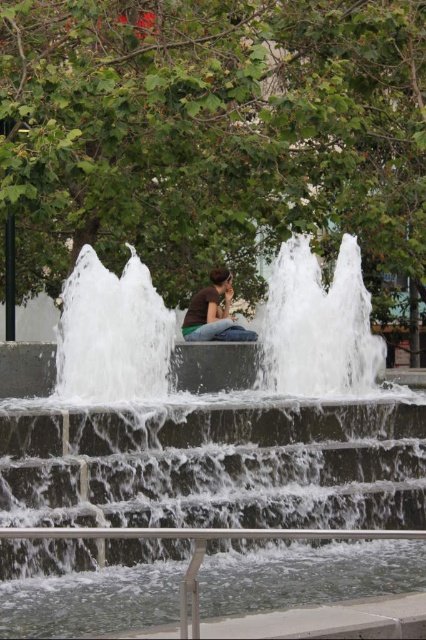
Question: Which object appears farthest from the camera in this image?

Choices:
 (A) matte brown shirt at center
 (B) white concrete fountain at center

Answer: (A)

Question: Does white concrete fountain at center have a smaller size compared to matte brown shirt at center?

Choices:
 (A) no
 (B) yes

Answer: (A)

Question: Which of the following is the farthest from the observer?

Choices:
 (A) (115, 561)
 (B) (196, 339)

Answer: (B)

Question: Can you confirm if white concrete fountain at center is positioned to the left of matte brown shirt at center?

Choices:
 (A) no
 (B) yes

Answer: (A)

Question: Which point is farther to the camera?

Choices:
 (A) (207, 317)
 (B) (2, 602)

Answer: (A)

Question: Is white concrete fountain at center to the right of matte brown shirt at center from the viewer's perspective?

Choices:
 (A) no
 (B) yes

Answer: (B)